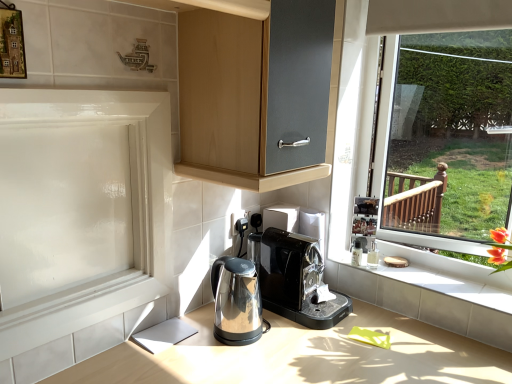
Question: Considering the positions of white tile at lower right and satin metallic countertop at center in the image, is white tile at lower right bigger or smaller than satin metallic countertop at center?

Choices:
 (A) small
 (B) big

Answer: (A)

Question: From the image's perspective, is white tile at lower right located above or below satin metallic countertop at center?

Choices:
 (A) below
 (B) above

Answer: (B)

Question: Which of these objects is positioned closest to the white glossy screen door at left?

Choices:
 (A) black plastic coffee machine at center, marked as the 1th home appliance in a right-to-left arrangement
 (B) satin metallic countertop at center
 (C) stainless steel kettle at lower center, placed as the first home appliance when sorted from left to right
 (D) white tile at lower right

Answer: (C)

Question: Based on their relative distances, which object is nearer to the stainless steel kettle at lower center, the second home appliance from the right?

Choices:
 (A) black plastic coffee machine at center, marked as the 1th home appliance in a right-to-left arrangement
 (B) white tile at lower right
 (C) white glossy screen door at left
 (D) satin metallic countertop at center

Answer: (A)